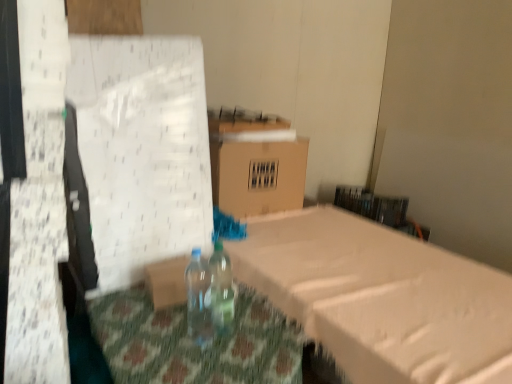
Question: From the image's perspective, is transparent plastic bottle at center, the first bottle when ordered from right to left, positioned above or below translucent plastic bottle at center, the 1th bottle from the left?

Choices:
 (A) above
 (B) below

Answer: (A)

Question: In terms of height, does transparent plastic bottle at center, the 2th bottle when ordered from left to right, look taller or shorter compared to translucent plastic bottle at center, which is the second bottle in right-to-left order?

Choices:
 (A) tall
 (B) short

Answer: (B)

Question: Which object is the farthest from the brown cardboard box at center?

Choices:
 (A) translucent plastic bottle at center, the 1th bottle from the left
 (B) transparent plastic bottle at center, the first bottle when ordered from right to left

Answer: (A)

Question: Which of these objects is positioned farthest from the transparent plastic bottle at center, the 2th bottle when ordered from left to right?

Choices:
 (A) translucent plastic bottle at center, the 1th bottle from the left
 (B) brown cardboard box at center

Answer: (B)